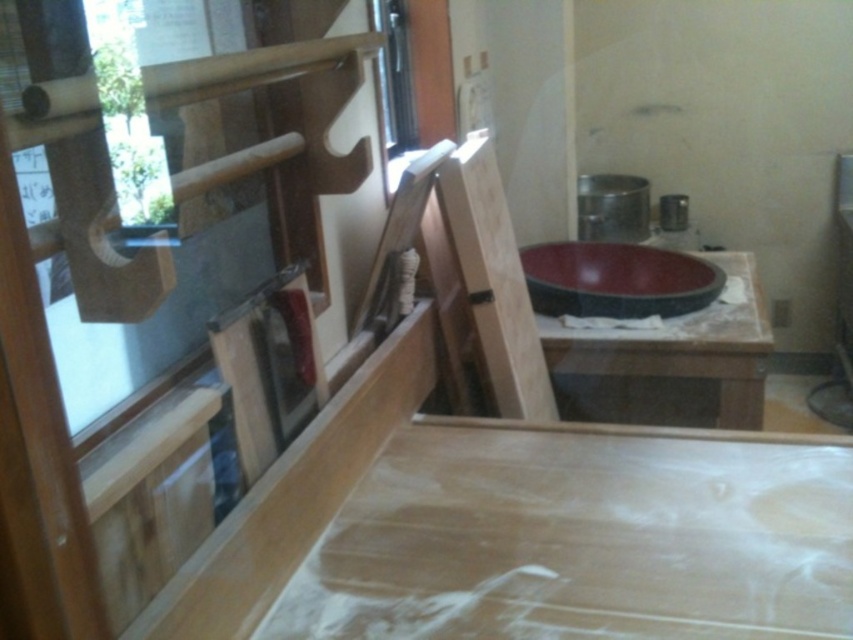
Which of these two, matte black bowl at center or matte black sink at center, stands taller?

matte black bowl at center

This screenshot has width=853, height=640. What do you see at coordinates (682, 353) in the screenshot? I see `matte black bowl at center` at bounding box center [682, 353].

Where is `matte black bowl at center`? The width and height of the screenshot is (853, 640). matte black bowl at center is located at coordinates (682, 353).

Is smooth light brown plywood at center bigger than matte black sink at center?

Yes.

Is point (596, 605) positioned in front of point (668, 282)?

Yes, point (596, 605) is in front of point (668, 282).

Who is more forward, (473, 598) or (671, 284)?

Point (473, 598) is more forward.

Locate an element on the screen. The height and width of the screenshot is (640, 853). smooth light brown plywood at center is located at coordinates (579, 540).

At what (x,y) coordinates should I click in order to perform the action: click on smooth light brown plywood at center. Please return your answer as a coordinate pair (x, y). This screenshot has width=853, height=640. Looking at the image, I should click on (579, 540).

What do you see at coordinates (579, 540) in the screenshot? The image size is (853, 640). I see `smooth light brown plywood at center` at bounding box center [579, 540].

Find the location of a particular element. The image size is (853, 640). smooth light brown plywood at center is located at coordinates (579, 540).